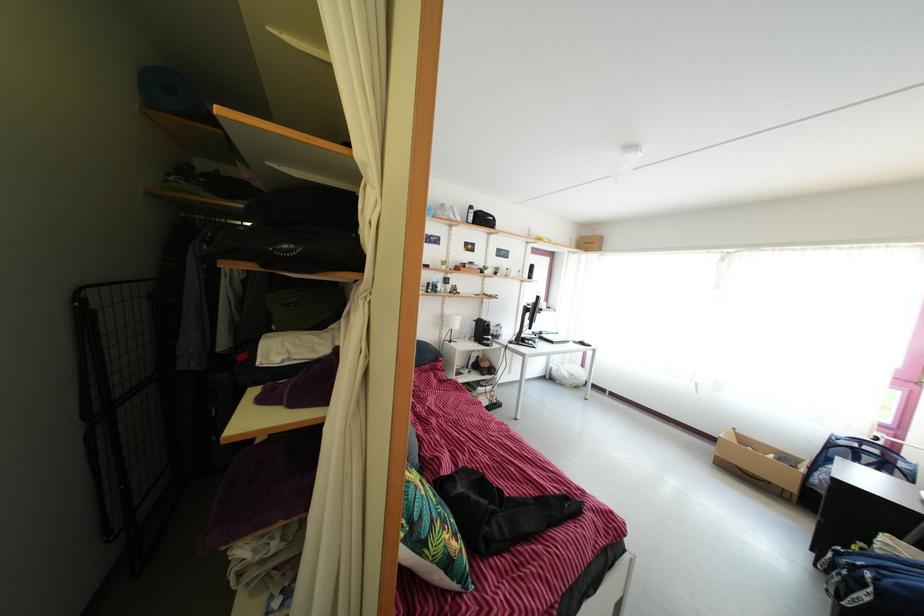
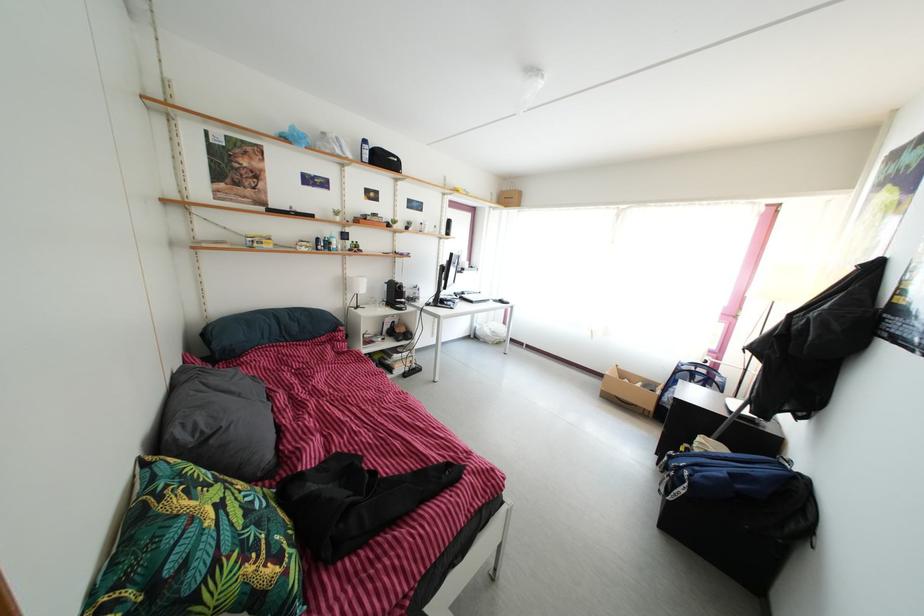
Locate, in the second image, the point that corresponds to (448,315) in the first image.

(350, 277)